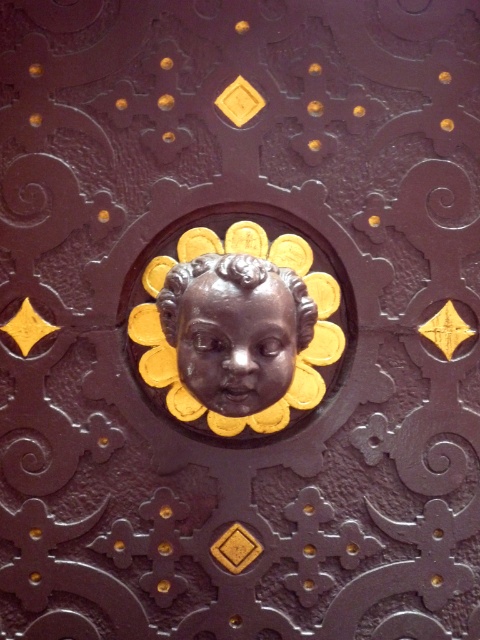
You are an artisan working on a metalwork piece. You need to place a new decorative element between the bronze statue at center and the matte bronze cherub at center. The element must be exactly 5 inches long. Will it fit in the space between them?

The space between the bronze statue at center and the matte bronze cherub at center is 4.87 inches. Since the decorative element is 5 inches long, it will not fit in the available space.

You are an art conservator examining the decorative metalwork piece. You notice two elements at the center of the piece. Which one is closer to you, the bronze statue at center or the matte bronze cherub at center?

The bronze statue at center is closer to you than the matte bronze cherub at center because the description states that the bronze statue is in front of the matte bronze cherub.